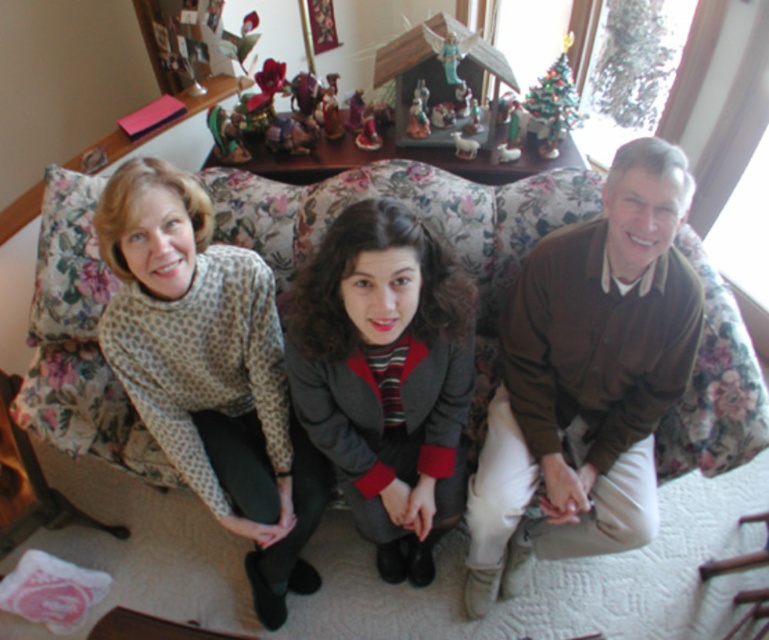
Question: Which object is closer to the camera taking this photo?

Choices:
 (A) gray wool blazer at center
 (B) printed sweater at left
 (C) brown cotton shirt at right

Answer: (A)

Question: Can you confirm if printed sweater at left is positioned below gray wool blazer at center?

Choices:
 (A) no
 (B) yes

Answer: (A)

Question: Which point is closer to the camera taking this photo?

Choices:
 (A) (505, 557)
 (B) (538, 452)
 (C) (248, 385)
 (D) (415, 253)

Answer: (D)

Question: Can you confirm if brown cotton shirt at right is wider than printed sweater at left?

Choices:
 (A) no
 (B) yes

Answer: (B)

Question: Which point appears farthest from the camera in this image?

Choices:
 (A) (661, 141)
 (B) (606, 461)
 (C) (454, 330)

Answer: (B)

Question: Is patterned sweater at center bigger than printed sweater at left?

Choices:
 (A) yes
 (B) no

Answer: (A)